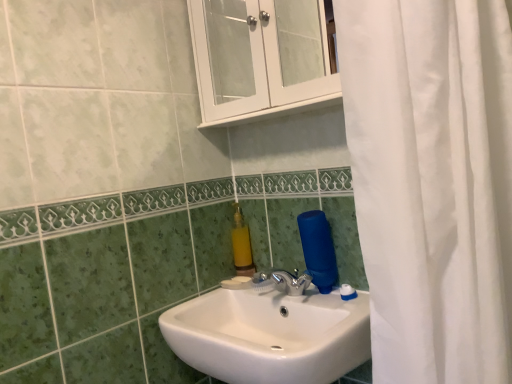
Question: Is white glossy cabinet at upper center completely or partially outside of yellow matte soap dispenser at upper center?

Choices:
 (A) yes
 (B) no

Answer: (A)

Question: Is white glossy cabinet at upper center at the left side of yellow matte soap dispenser at upper center?

Choices:
 (A) yes
 (B) no

Answer: (B)

Question: Would you consider white glossy cabinet at upper center to be distant from yellow matte soap dispenser at upper center?

Choices:
 (A) yes
 (B) no

Answer: (B)

Question: From the image's perspective, is white glossy cabinet at upper center located above yellow matte soap dispenser at upper center?

Choices:
 (A) yes
 (B) no

Answer: (A)

Question: Does white glossy cabinet at upper center have a larger size compared to yellow matte soap dispenser at upper center?

Choices:
 (A) yes
 (B) no

Answer: (A)

Question: Is white glossy cabinet at upper center facing away from yellow matte soap dispenser at upper center?

Choices:
 (A) yes
 (B) no

Answer: (B)

Question: Considering the relative positions of yellow matte soap dispenser at upper center and white glossy sink at center in the image provided, is yellow matte soap dispenser at upper center to the right of white glossy sink at center from the viewer's perspective?

Choices:
 (A) yes
 (B) no

Answer: (B)

Question: Is yellow matte soap dispenser at upper center turned away from white glossy sink at center?

Choices:
 (A) yes
 (B) no

Answer: (B)

Question: Is yellow matte soap dispenser at upper center smaller than white glossy sink at center?

Choices:
 (A) no
 (B) yes

Answer: (B)

Question: Can you confirm if yellow matte soap dispenser at upper center is wider than white glossy sink at center?

Choices:
 (A) yes
 (B) no

Answer: (B)

Question: Does yellow matte soap dispenser at upper center have a lesser width compared to white glossy sink at center?

Choices:
 (A) yes
 (B) no

Answer: (A)

Question: From a real-world perspective, is yellow matte soap dispenser at upper center located beneath white glossy sink at center?

Choices:
 (A) yes
 (B) no

Answer: (B)

Question: Is white glossy cabinet at upper center facing away from white glossy sink at center?

Choices:
 (A) yes
 (B) no

Answer: (B)